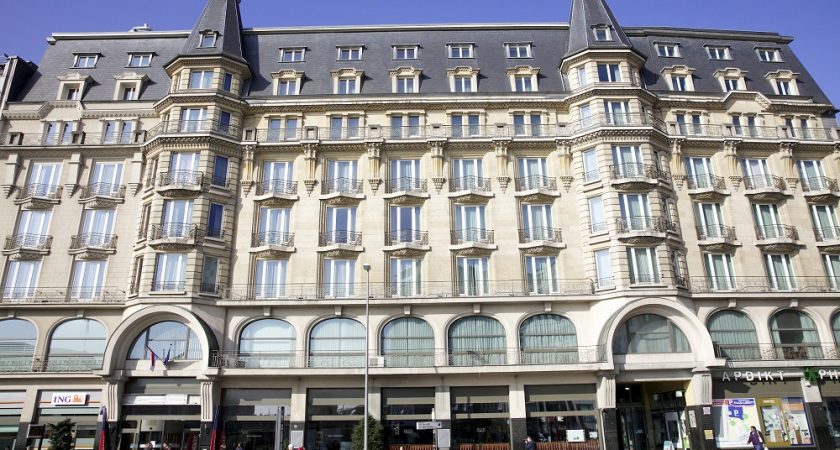
This screenshot has width=840, height=450. I want to click on doorway arch, so click(x=662, y=309), click(x=170, y=312).